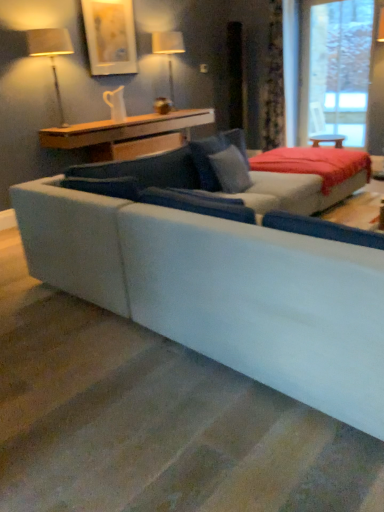
Question: Is suede blue pillow at center located outside velvet floral curtain at upper right?

Choices:
 (A) yes
 (B) no

Answer: (A)

Question: Is suede blue pillow at center oriented away from velvet floral curtain at upper right?

Choices:
 (A) yes
 (B) no

Answer: (B)

Question: Does suede blue pillow at center have a larger size compared to velvet floral curtain at upper right?

Choices:
 (A) yes
 (B) no

Answer: (B)

Question: Is suede blue pillow at center closer to the viewer compared to velvet floral curtain at upper right?

Choices:
 (A) yes
 (B) no

Answer: (A)

Question: Does suede blue pillow at center have a lesser width compared to velvet floral curtain at upper right?

Choices:
 (A) no
 (B) yes

Answer: (B)

Question: Based on their positions, is suede gray couch at center located to the left or right of wooden table at upper center?

Choices:
 (A) right
 (B) left

Answer: (A)

Question: From their relative heights in the image, would you say suede gray couch at center is taller or shorter than wooden table at upper center?

Choices:
 (A) tall
 (B) short

Answer: (A)

Question: Relative to wooden table at upper center, is suede gray couch at center in front or behind?

Choices:
 (A) front
 (B) behind

Answer: (A)

Question: Is suede gray couch at center spatially inside wooden table at upper center, or outside of it?

Choices:
 (A) outside
 (B) inside

Answer: (A)

Question: In terms of width, does matte silver table lamp at upper left, the 1th table lamp positioned from the left, look wider or thinner when compared to velvet gray bed at center?

Choices:
 (A) wide
 (B) thin

Answer: (B)

Question: Relative to velvet gray bed at center, is matte silver table lamp at upper left, which is the second table lamp in right-to-left order, in front or behind?

Choices:
 (A) behind
 (B) front

Answer: (A)

Question: Is matte silver table lamp at upper left, which appears as the 1th table lamp when viewed from the front, bigger or smaller than velvet gray bed at center?

Choices:
 (A) big
 (B) small

Answer: (B)

Question: From a real-world perspective, is matte silver table lamp at upper left, the 1th table lamp positioned from the left, physically located above or below velvet gray bed at center?

Choices:
 (A) above
 (B) below

Answer: (A)

Question: From the image's perspective, is transparent glass window at upper right positioned above or below velvet gray bed at center?

Choices:
 (A) above
 (B) below

Answer: (A)

Question: Do you think transparent glass window at upper right is within velvet gray bed at center, or outside of it?

Choices:
 (A) outside
 (B) inside

Answer: (A)